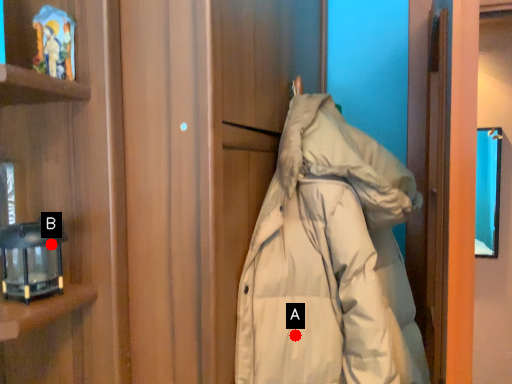
Question: Two points are circled on the image, labeled by A and B beside each circle. Which of the following is the farthest from the observer?

Choices:
 (A) A is further
 (B) B is further

Answer: (A)